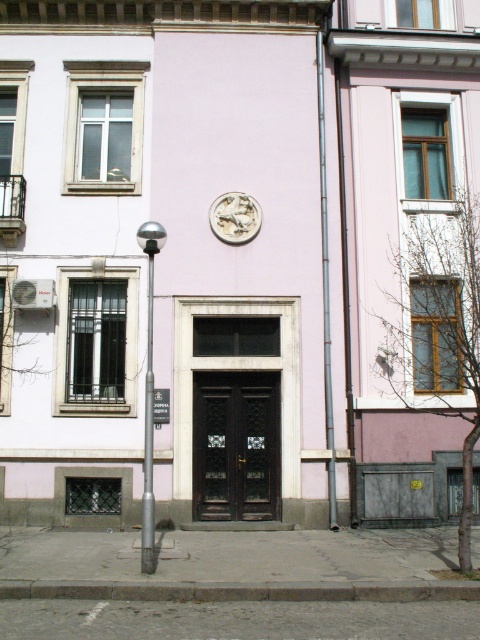
You are a delivery person approaching the building and need to find the entrance. You see a metallic silver pole at center and a white plastic sign at center. Which object is closer to the entrance?

The metallic silver pole at center is located below the white plastic sign at center, so the metallic silver pole at center is closer to the entrance since it is positioned lower.

In the scene shown: You are standing at the base of the building and want to reach the metallic silver pole at center without moving closer to the building. Is it possible to touch the pole from your current position?

The metallic silver pole at center is 8.70 meters from viewer, so you cannot reach it without moving closer.